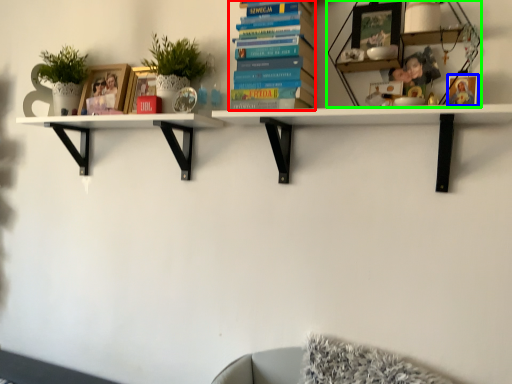
Question: Based on their relative distances, which object is farther from book (highlighted by a red box)? Choose from picture frame (highlighted by a blue box) and shelf (highlighted by a green box).

Choices:
 (A) picture frame
 (B) shelf

Answer: (A)